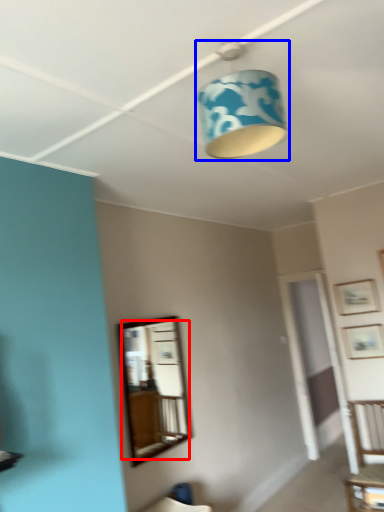
Question: Which point is closer to the camera, mirror (highlighted by a red box) or lamp (highlighted by a blue box)?

Choices:
 (A) mirror
 (B) lamp

Answer: (B)